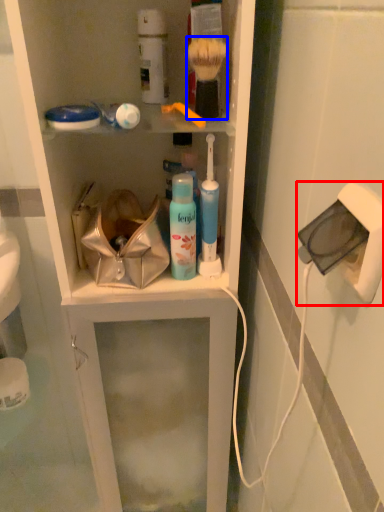
Question: Which point is further to the camera, electric outlet (highlighted by a red box) or brush (highlighted by a blue box)?

Choices:
 (A) electric outlet
 (B) brush

Answer: (B)